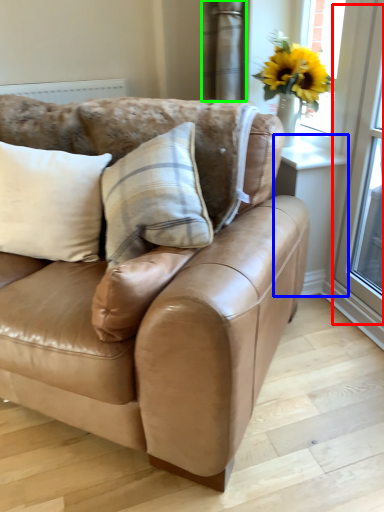
Question: Considering the real-world distances, which object is closest to screen door (highlighted by a red box)? window (highlighted by a blue box) or curtain (highlighted by a green box).

Choices:
 (A) window
 (B) curtain

Answer: (A)